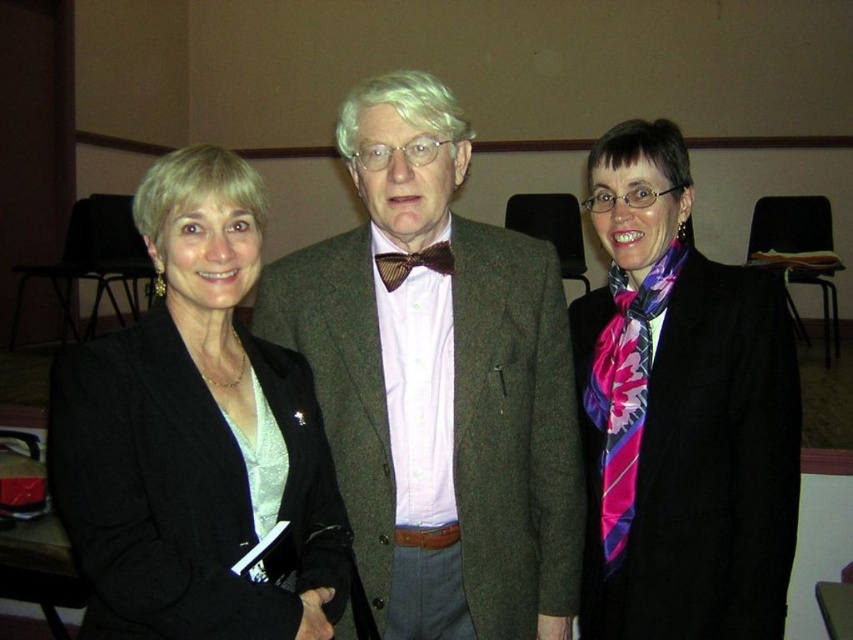
Question: Which point is farther from the camera taking this photo?

Choices:
 (A) (91, 436)
 (B) (595, 598)

Answer: (B)

Question: Is brown woolen suit at center closer to the viewer compared to pink silk scarf at center?

Choices:
 (A) no
 (B) yes

Answer: (B)

Question: Which of the following is the closest to the observer?

Choices:
 (A) (422, 432)
 (B) (126, 605)
 (C) (631, 609)

Answer: (B)

Question: Can you confirm if brown woolen suit at center is positioned above pink silk scarf at center?

Choices:
 (A) yes
 (B) no

Answer: (B)

Question: Which of these objects is positioned closest to the brown woolen suit at center?

Choices:
 (A) brown textured bow tie at center
 (B) black fabric jacket at left
 (C) pink silk scarf at center

Answer: (A)

Question: Is brown woolen suit at center wider than black fabric jacket at left?

Choices:
 (A) no
 (B) yes

Answer: (B)